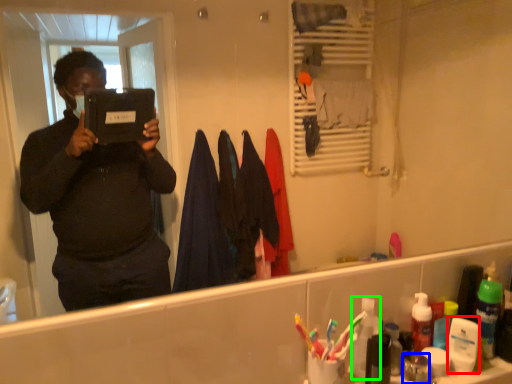
Question: Based on their relative distances, which object is farther from toiletry (highlighted by a red box)? Choose from toiletry (highlighted by a blue box) and toiletry (highlighted by a green box).

Choices:
 (A) toiletry
 (B) toiletry

Answer: (B)